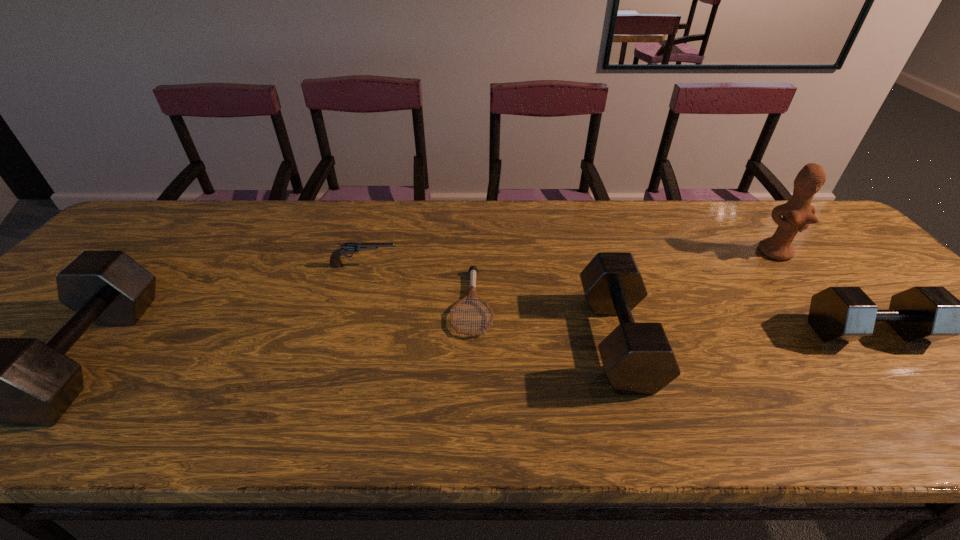
Identify the location of vacant region that satisfies the following two spatial constraints: 1. aiming along the barrel of the second farthest object; 2. on the back side of the fourth shortest object. (341, 339).

Find the location of a particular element. vacant space that satisfies the following two spatial constraints: 1. on the back side of the second tallest dumbbell; 2. aiming along the barrel of the second farthest object is located at coordinates (595, 266).